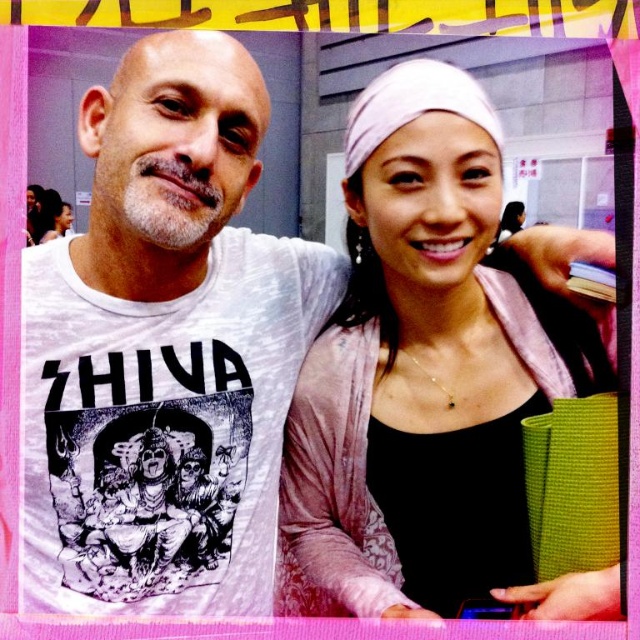
Which is below, white cotton t-shirt at left or pink fabric headband at upper right?

pink fabric headband at upper right is lower down.

Can you confirm if white cotton t-shirt at left is taller than pink fabric headband at upper right?

Correct, white cotton t-shirt at left is much taller as pink fabric headband at upper right.

Does point (186, 221) come behind point (429, 508)?

That is False.

This screenshot has width=640, height=640. In order to click on white cotton t-shirt at left in this screenshot , I will do `click(164, 348)`.